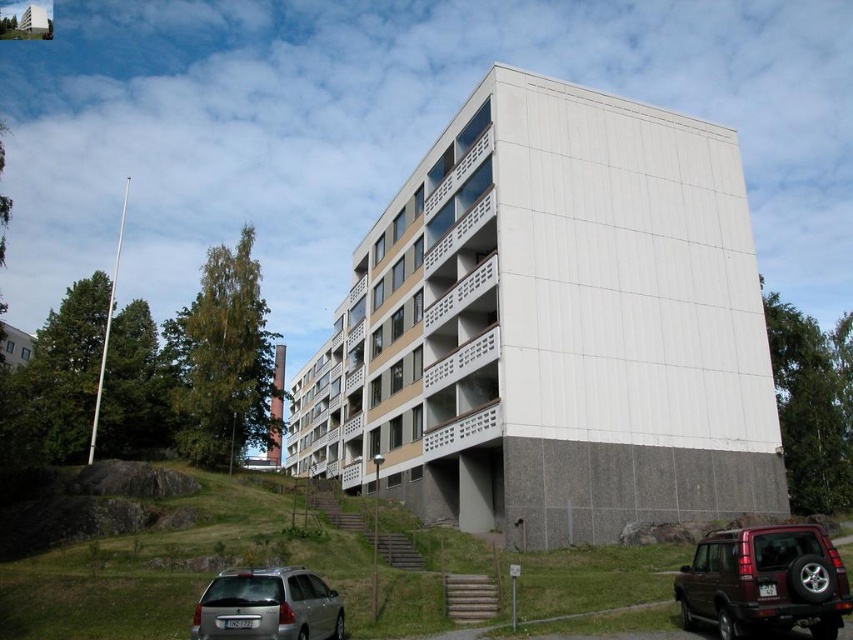
You are standing in front of the building and see the green grass at lower center and the shiny maroon suv at lower right. Which object is positioned to the left of the other?

The green grass at lower center is positioned to the left of the shiny maroon suv at lower right.

You are a gardener who needs to mow the lawn. You see the green grass at lower center and the shiny maroon suv at lower right. Which area should you avoid mowing to prevent damaging the vehicle?

You should avoid mowing near the shiny maroon suv at lower right because the green grass at lower center is shorter than the shiny maroon suv at lower right, so the vehicle might be in a paved area where mowing isn

You are a gardener who needs to mow the lawn. You see the green grass at lower center and the silver metallic station wagon at lower left. Which area is easier to mow around?

The green grass at lower center is shorter than the silver metallic station wagon at lower left, so it would be easier to mow around the green grass at lower center since it requires less effort to cut shorter grass.